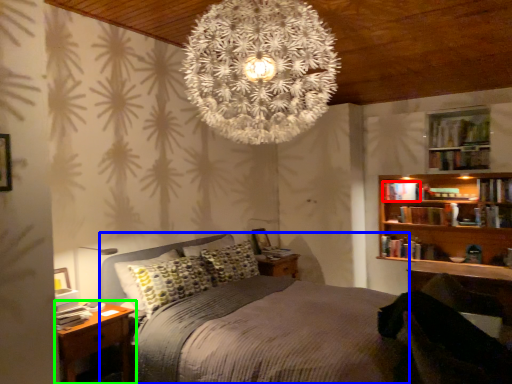
Question: Which object is positioned closest to book (highlighted by a red box)? Select from bed (highlighted by a blue box) and nightstand (highlighted by a green box).

Choices:
 (A) bed
 (B) nightstand

Answer: (A)